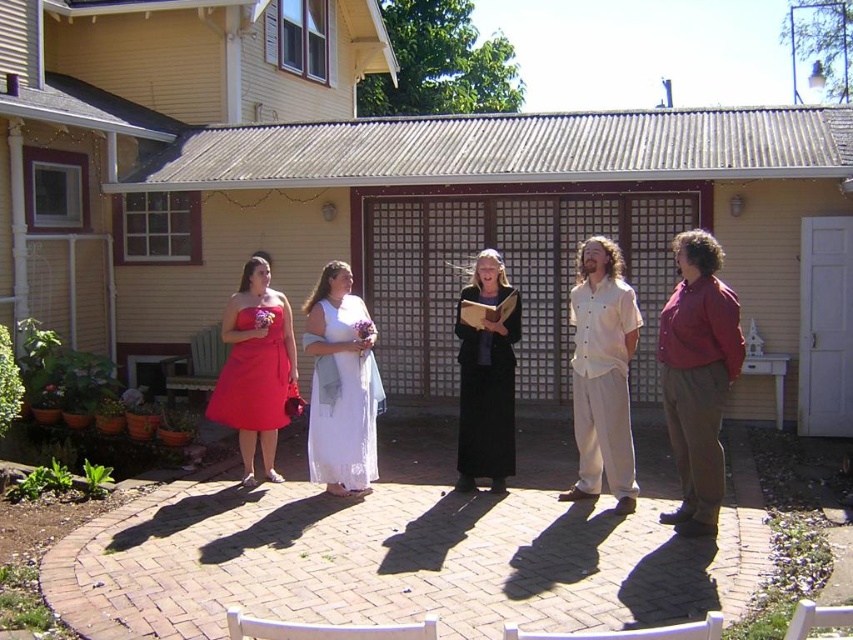
You are a photographer trying to capture a clear shot of the red cotton shirt at center and the black silk dress at center. Which one is blocking the view of the other?

The red cotton shirt at center is in front of the black silk dress at center, so it is blocking the view of the black silk dress at center.

You are planning to take a photo of the group and need to ensure both the red cotton shirt at center and the black silk dress at center are clearly visible. Given their sizes, which one might require more space in the frame to capture fully?

The red cotton shirt at center is larger in size than the black silk dress at center, so it would require more space in the frame to ensure it is fully visible.